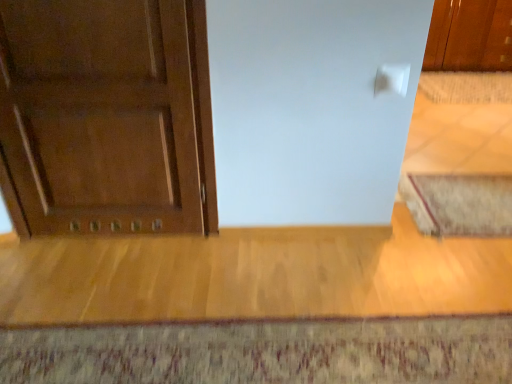
The width and height of the screenshot is (512, 384). I want to click on matte wood door at left, so click(106, 116).

Identify the location of glossy wood cabinet at upper right. Image resolution: width=512 pixels, height=384 pixels. (470, 36).

What do you see at coordinates (459, 204) in the screenshot?
I see `beige textured rug at lower right, acting as the 2th doormat starting from the back` at bounding box center [459, 204].

You are a GUI agent. You are given a task and a screenshot of the screen. Output one action in this format:
    pyautogui.click(x=<x>, y=<y>)
    Task: Click on the textured wool doormat at lower center, the 1th doormat positioned from the left
    This screenshot has width=512, height=384.
    Given the screenshot: What is the action you would take?
    click(x=264, y=352)

This screenshot has height=384, width=512. What are the coordinates of `beige woven mat at right, the 3th doormat in the bottom-to-top sequence` in the screenshot? It's located at (466, 87).

Can you confirm if textured wool doormat at lower center, positioned as the 1th doormat in front-to-back order, is bigger than beige woven mat at right, which is counted as the third doormat, starting from the front?

Actually, textured wool doormat at lower center, positioned as the 1th doormat in front-to-back order, might be smaller than beige woven mat at right, which is counted as the third doormat, starting from the front.

From a real-world perspective, is textured wool doormat at lower center, positioned as the 1th doormat in front-to-back order, physically below beige woven mat at right, which appears as the first doormat when viewed from the top?

Correct, in the physical world, textured wool doormat at lower center, positioned as the 1th doormat in front-to-back order, is lower than beige woven mat at right, which appears as the first doormat when viewed from the top.

Does textured wool doormat at lower center, the third doormat in the top-to-bottom sequence, touch beige woven mat at right, the 3th doormat in the bottom-to-top sequence?

textured wool doormat at lower center, the third doormat in the top-to-bottom sequence, and beige woven mat at right, the 3th doormat in the bottom-to-top sequence, are not in contact.

In the scene shown: Is textured wool doormat at lower center, the third doormat in the top-to-bottom sequence, oriented away from beige woven mat at right, which is the third doormat from left to right?

textured wool doormat at lower center, the third doormat in the top-to-bottom sequence, is not turned away from beige woven mat at right, which is the third doormat from left to right.

Is glossy wood cabinet at upper right in contact with textured wool doormat at lower center, which is counted as the 3th doormat, starting from the back?

No, glossy wood cabinet at upper right is not with textured wool doormat at lower center, which is counted as the 3th doormat, starting from the back.

Considering the relative sizes of glossy wood cabinet at upper right and textured wool doormat at lower center, arranged as the 1th doormat when ordered from the bottom, in the image provided, is glossy wood cabinet at upper right wider than textured wool doormat at lower center, arranged as the 1th doormat when ordered from the bottom,?

In fact, glossy wood cabinet at upper right might be narrower than textured wool doormat at lower center, arranged as the 1th doormat when ordered from the bottom.

How distant is glossy wood cabinet at upper right from textured wool doormat at lower center, the 1th doormat positioned from the left?

glossy wood cabinet at upper right is 3.57 meters away from textured wool doormat at lower center, the 1th doormat positioned from the left.

Which is behind, point (489, 46) or point (129, 378)?

Positioned behind is point (489, 46).

Consider the image. Considering the sizes of glossy wood cabinet at upper right and beige textured rug at lower right, the 2th doormat from the left, in the image, is glossy wood cabinet at upper right bigger or smaller than beige textured rug at lower right, the 2th doormat from the left,?

Clearly, glossy wood cabinet at upper right is larger in size than beige textured rug at lower right, the 2th doormat from the left.

Are glossy wood cabinet at upper right and beige textured rug at lower right, which ranks as the second doormat in bottom-to-top order, beside each other?

glossy wood cabinet at upper right and beige textured rug at lower right, which ranks as the second doormat in bottom-to-top order, are clearly separated.

Is glossy wood cabinet at upper right oriented towards beige textured rug at lower right, acting as the 2th doormat starting from the right?

No, glossy wood cabinet at upper right does not turn towards beige textured rug at lower right, acting as the 2th doormat starting from the right.

Considering the sizes of glossy wood cabinet at upper right and beige textured rug at lower right, placed as the 2th doormat when sorted from top to bottom, in the image, is glossy wood cabinet at upper right taller or shorter than beige textured rug at lower right, placed as the 2th doormat when sorted from top to bottom,?

In the image, glossy wood cabinet at upper right appears to be taller than beige textured rug at lower right, placed as the 2th doormat when sorted from top to bottom.

Is textured wool doormat at lower center, which ranks as the third doormat in right-to-left order, inside the boundaries of beige textured rug at lower right, which is the second doormat in front-to-back order, or outside?

textured wool doormat at lower center, which ranks as the third doormat in right-to-left order, lies outside beige textured rug at lower right, which is the second doormat in front-to-back order.

Between textured wool doormat at lower center, the third doormat in the top-to-bottom sequence, and beige textured rug at lower right, which is the second doormat in front-to-back order, which one has more height?

With more height is beige textured rug at lower right, which is the second doormat in front-to-back order.

How far apart are textured wool doormat at lower center, the third doormat in the top-to-bottom sequence, and beige textured rug at lower right, the 2th doormat from the left?

A distance of 39.07 inches exists between textured wool doormat at lower center, the third doormat in the top-to-bottom sequence, and beige textured rug at lower right, the 2th doormat from the left.

Does point (482, 319) come closer to viewer compared to point (426, 215)?

Yes, point (482, 319) is in front of point (426, 215).

Considering the positions of objects beige textured rug at lower right, acting as the 2th doormat starting from the back, and beige woven mat at right, which appears as the first doormat when viewed from the top, in the image provided, who is more to the left, beige textured rug at lower right, acting as the 2th doormat starting from the back, or beige woven mat at right, which appears as the first doormat when viewed from the top,?

beige textured rug at lower right, acting as the 2th doormat starting from the back.

Who is shorter, beige textured rug at lower right, which ranks as the second doormat in bottom-to-top order, or beige woven mat at right, which is counted as the third doormat, starting from the front?

beige textured rug at lower right, which ranks as the second doormat in bottom-to-top order, is shorter.

Does beige textured rug at lower right, which is the second doormat in front-to-back order, come in front of beige woven mat at right, the 1th doormat viewed from the back?

Yes, it is.

From the picture: Looking at their sizes, would you say beige textured rug at lower right, which ranks as the second doormat in bottom-to-top order, is wider or thinner than beige woven mat at right, which is counted as the third doormat, starting from the front?

Clearly, beige textured rug at lower right, which ranks as the second doormat in bottom-to-top order, has less width compared to beige woven mat at right, which is counted as the third doormat, starting from the front.

Considering the relative sizes of beige woven mat at right, the 1th doormat viewed from the back, and glossy wood cabinet at upper right in the image provided, is beige woven mat at right, the 1th doormat viewed from the back, thinner than glossy wood cabinet at upper right?

Correct, the width of beige woven mat at right, the 1th doormat viewed from the back, is less than that of glossy wood cabinet at upper right.

In terms of height, does beige woven mat at right, which is the third doormat from left to right, look taller or shorter compared to glossy wood cabinet at upper right?

beige woven mat at right, which is the third doormat from left to right, is shorter than glossy wood cabinet at upper right.

Is beige woven mat at right, the 3th doormat in the bottom-to-top sequence, next to glossy wood cabinet at upper right and touching it?

No, beige woven mat at right, the 3th doormat in the bottom-to-top sequence, is not in contact with glossy wood cabinet at upper right.

Which is correct: beige woven mat at right, the 3th doormat in the bottom-to-top sequence, is inside glossy wood cabinet at upper right, or outside of it?

beige woven mat at right, the 3th doormat in the bottom-to-top sequence, is located beyond the bounds of glossy wood cabinet at upper right.

From a real-world perspective, who is located lower, matte wood door at left or beige woven mat at right, which is counted as the third doormat, starting from the front?

beige woven mat at right, which is counted as the third doormat, starting from the front, from a real-world perspective.

From the image's perspective, is matte wood door at left under beige woven mat at right, which is counted as the third doormat, starting from the front?

Yes.

Is matte wood door at left to the left of beige woven mat at right, the 1th doormat viewed from the back, from the viewer's perspective?

Correct, you'll find matte wood door at left to the left of beige woven mat at right, the 1th doormat viewed from the back.

I want to click on doormat that is the 2nd one when counting backward from the textured wool doormat at lower center, the 1th doormat positioned from the left, so click(466, 87).

What are the coordinates of `doormat that is the 3rd object located below the glossy wood cabinet at upper right (from the image's perspective)` in the screenshot? It's located at (264, 352).

Looking at this image, when comparing their distances from beige woven mat at right, the 3th doormat in the bottom-to-top sequence, does matte wood door at left or glossy wood cabinet at upper right seem closer?

The object closer to beige woven mat at right, the 3th doormat in the bottom-to-top sequence, is glossy wood cabinet at upper right.

Based on their spatial positions, is textured wool doormat at lower center, the 1th doormat positioned from the left, or matte wood door at left closer to beige textured rug at lower right, the 2th doormat from the left?

textured wool doormat at lower center, the 1th doormat positioned from the left, is positioned closer to the anchor beige textured rug at lower right, the 2th doormat from the left.

Considering their positions, is textured wool doormat at lower center, the 1th doormat positioned from the left, positioned closer to glossy wood cabinet at upper right than matte wood door at left?

The object closer to glossy wood cabinet at upper right is matte wood door at left.

Considering their positions, is matte wood door at left positioned closer to textured wool doormat at lower center, which ranks as the third doormat in right-to-left order, than beige woven mat at right, which appears as the first doormat when viewed from the top?

Among the two, matte wood door at left is located nearer to textured wool doormat at lower center, which ranks as the third doormat in right-to-left order.

When comparing their distances from matte wood door at left, does beige woven mat at right, which appears as the first doormat when viewed from the top, or glossy wood cabinet at upper right seem closer?

beige woven mat at right, which appears as the first doormat when viewed from the top.

When comparing their distances from beige woven mat at right, which is counted as the third doormat, starting from the front, does glossy wood cabinet at upper right or textured wool doormat at lower center, which ranks as the third doormat in right-to-left order, seem closer?

glossy wood cabinet at upper right lies closer to beige woven mat at right, which is counted as the third doormat, starting from the front, than the other object.

In the scene shown: Based on their spatial positions, is glossy wood cabinet at upper right or beige woven mat at right, which is the third doormat from left to right, closer to matte wood door at left?

Among the two, beige woven mat at right, which is the third doormat from left to right, is located nearer to matte wood door at left.

Based on their spatial positions, is textured wool doormat at lower center, arranged as the 1th doormat when ordered from the bottom, or beige textured rug at lower right, which is the second doormat in front-to-back order, further from beige woven mat at right, the 1th doormat viewed from the back?

Among the two, textured wool doormat at lower center, arranged as the 1th doormat when ordered from the bottom, is located further to beige woven mat at right, the 1th doormat viewed from the back.

This screenshot has width=512, height=384. In order to click on doormat between beige textured rug at lower right, the 2th doormat from the left, and glossy wood cabinet at upper right, along the z-axis in this screenshot , I will do coord(466,87).

The width and height of the screenshot is (512, 384). In order to click on doormat located between textured wool doormat at lower center, positioned as the 1th doormat in front-to-back order, and beige woven mat at right, which appears as the first doormat when viewed from the top, in the depth direction in this screenshot , I will do (x=459, y=204).

Locate an element on the screen. Image resolution: width=512 pixels, height=384 pixels. doormat between matte wood door at left and beige textured rug at lower right, which is the second doormat in front-to-back order, from left to right is located at coordinates (264, 352).